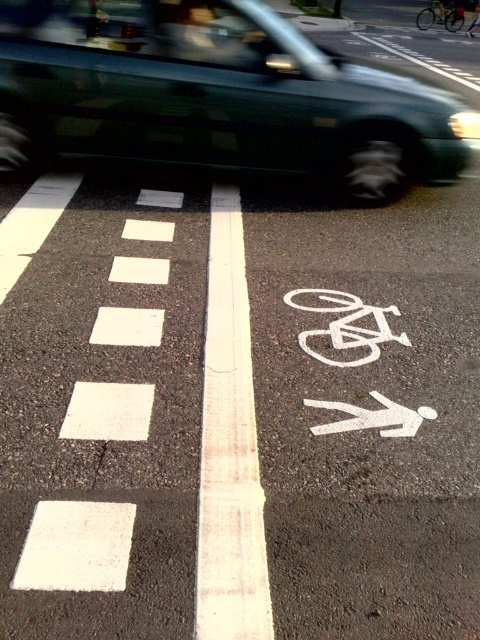
Who is positioned more to the left, white painted bike lane at center or metallic silver bicycle at center?

From the viewer's perspective, white painted bike lane at center appears more on the left side.

Can you confirm if white painted bike lane at center is positioned to the left of metallic silver bicycle at center?

Indeed, white painted bike lane at center is positioned on the left side of metallic silver bicycle at center.

Which is behind, point (379, 355) or point (444, 13)?

Point (444, 13)

At what (x,y) coordinates should I click in order to perform the action: click on white painted bike lane at center. Please return your answer as a coordinate pair (x, y). Looking at the image, I should click on (237, 412).

Which is above, white painted bike lane at center or green metallic van at upper center?

green metallic van at upper center

Where is `white painted bike lane at center`? The height and width of the screenshot is (640, 480). white painted bike lane at center is located at coordinates click(237, 412).

Between point (46, 0) and point (420, 28), which one is positioned behind?

The point (420, 28) is behind.

Find the location of a particular element. The width and height of the screenshot is (480, 640). green metallic van at upper center is located at coordinates (216, 96).